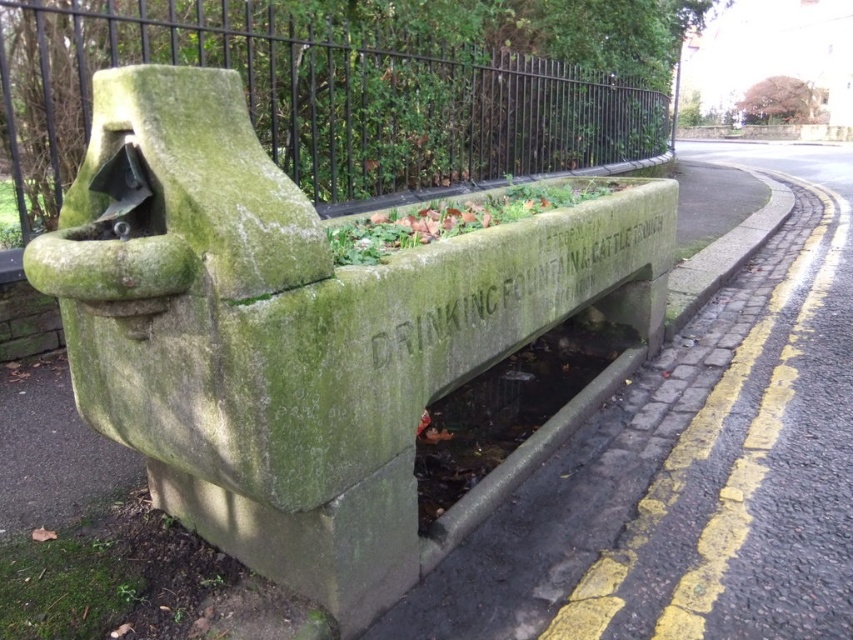
Who is positioned more to the left, green stone drinking fountain at lower center or green stone fence at upper left?

Positioned to the left is green stone fence at upper left.

Is green stone drinking fountain at lower center in front of green stone fence at upper left?

Yes, green stone drinking fountain at lower center is in front of green stone fence at upper left.

Find the location of `green stone drinking fountain at lower center`. green stone drinking fountain at lower center is located at coordinates (692, 467).

This screenshot has width=853, height=640. In order to click on green stone drinking fountain at lower center in this screenshot , I will do `click(692, 467)`.

Does green mossy stone drinking fountain at center come behind green stone fence at upper left?

No, it is in front of green stone fence at upper left.

Who is higher up, green mossy stone drinking fountain at center or green stone fence at upper left?

Positioned higher is green stone fence at upper left.

Where is `green mossy stone drinking fountain at center`? Image resolution: width=853 pixels, height=640 pixels. green mossy stone drinking fountain at center is located at coordinates (305, 333).

Can you confirm if green mossy stone drinking fountain at center is positioned to the left of green stone drinking fountain at lower center?

Correct, you'll find green mossy stone drinking fountain at center to the left of green stone drinking fountain at lower center.

Does green mossy stone drinking fountain at center appear over green stone drinking fountain at lower center?

Actually, green mossy stone drinking fountain at center is below green stone drinking fountain at lower center.

Where is `green mossy stone drinking fountain at center`? This screenshot has width=853, height=640. green mossy stone drinking fountain at center is located at coordinates (305, 333).